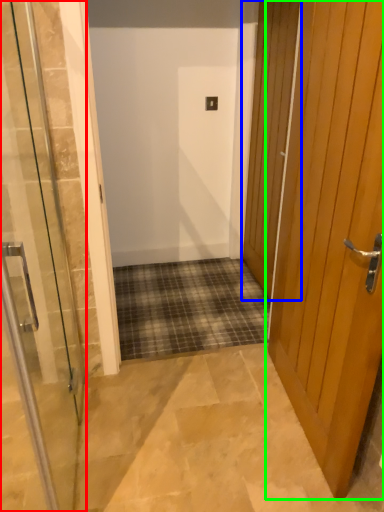
Question: Estimate the real-world distances between objects in this image. Which object is closer to door (highlighted by a red box), door (highlighted by a blue box) or door (highlighted by a green box)?

Choices:
 (A) door
 (B) door

Answer: (B)